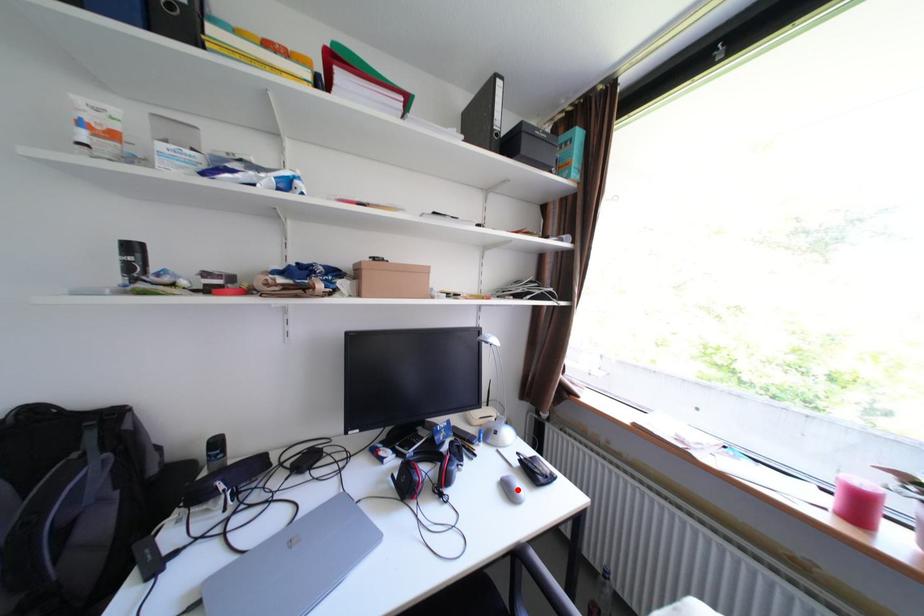
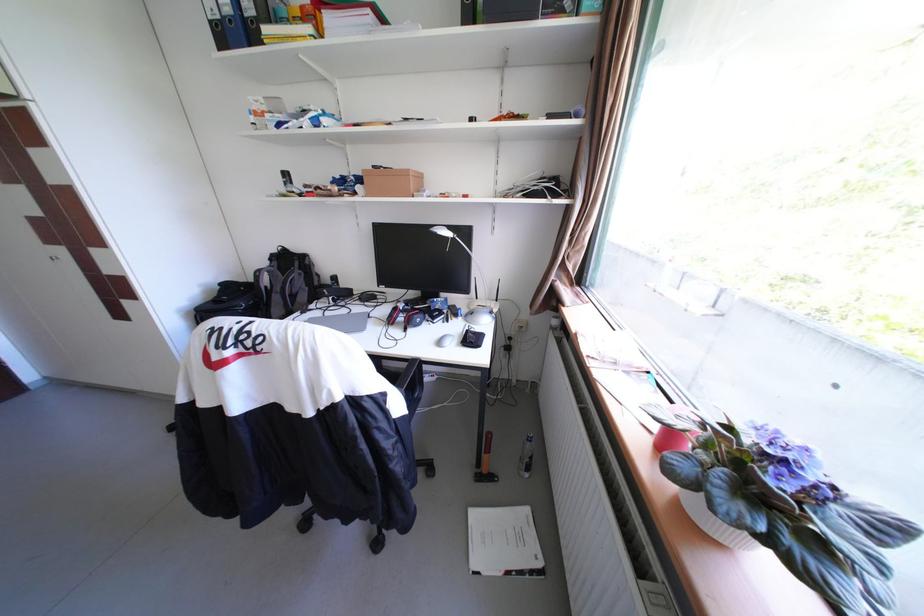
Question: I am providing you with two images of the same scene from different viewpoints. A red point is marked on the first image. Can you still see the location of the red point in image 2?

Choices:
 (A) Yes
 (B) No

Answer: (B)